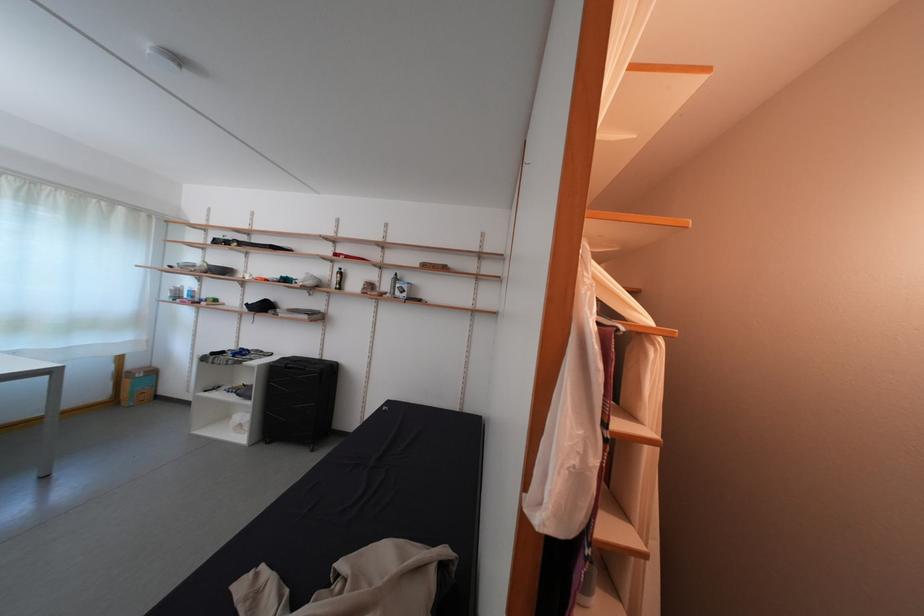
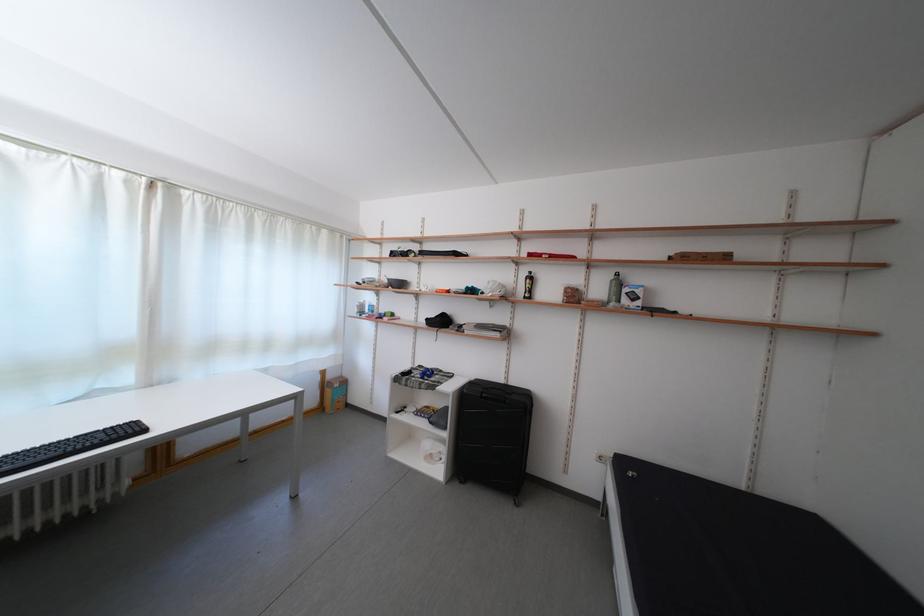
Which direction would the cameraman need to move to produce the second image?

The cameraman moved toward left, forward.